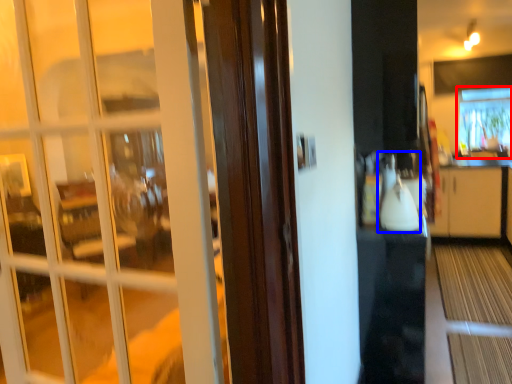
Question: Which of the following is the closest to the observer, window (highlighted by a red box) or appliance (highlighted by a blue box)?

Choices:
 (A) window
 (B) appliance

Answer: (B)